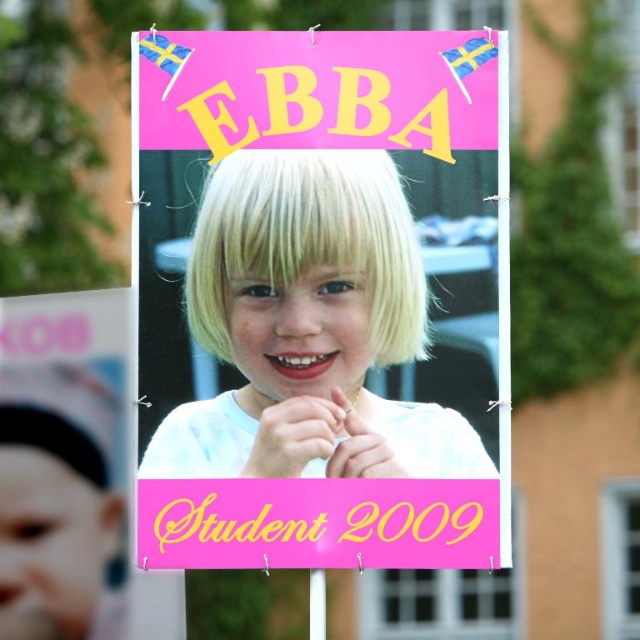
Can you confirm if white paper photo at center is taller than matte white headband at left?

Yes.

Who is more distant from viewer, (244, 45) or (83, 563)?

Point (83, 563)

The image size is (640, 640). Identify the location of white paper photo at center. (316, 296).